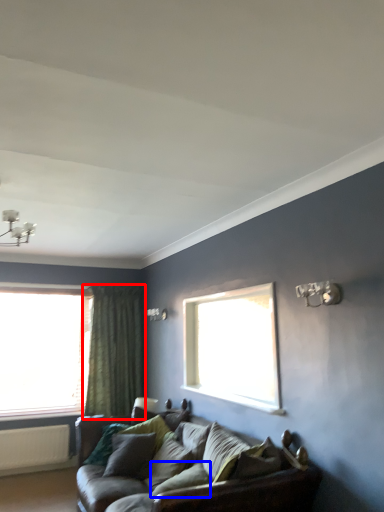
Question: Among these objects, which one is nearest to the camera, curtain (highlighted by a red box) or pillow (highlighted by a blue box)?

Choices:
 (A) curtain
 (B) pillow

Answer: (B)